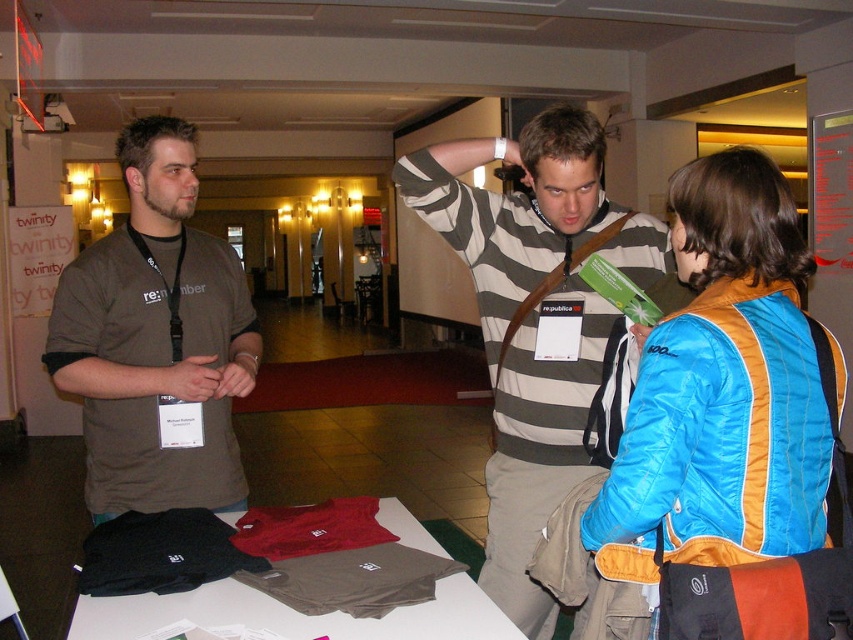
Question: Which point is farther from the camera taking this photo?

Choices:
 (A) (149, 232)
 (B) (589, 470)

Answer: (A)

Question: Which object is farther from the camera taking this photo?

Choices:
 (A) striped cotton shirt at center
 (B) matte brown t-shirt at left

Answer: (B)

Question: Does blue down jacket at center appear on the right side of striped cotton shirt at center?

Choices:
 (A) no
 (B) yes

Answer: (B)

Question: Estimate the real-world distances between objects in this image. Which object is closer to the striped cotton shirt at center?

Choices:
 (A) matte brown t-shirt at left
 (B) blue down jacket at center

Answer: (B)

Question: Can you confirm if blue down jacket at center is bigger than matte brown t-shirt at left?

Choices:
 (A) yes
 (B) no

Answer: (B)

Question: Observing the image, what is the correct spatial positioning of blue down jacket at center in reference to matte brown t-shirt at left?

Choices:
 (A) above
 (B) below

Answer: (B)